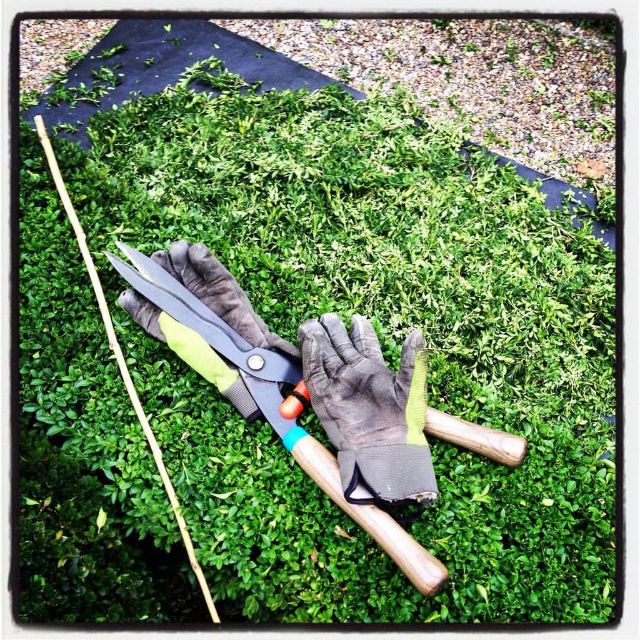
You are a gardener who needs to pick up both the gray fabric glove at center and the metallic shears at center. You can only reach one item at a time. If you first pick up the item that is closer to your hand, which one would you pick up first?

The gray fabric glove at center and metallic shears at center are 13.50 centimeters apart from each other, so you cannot determine which is closer to your hand without additional information about their positions relative to your starting point.

You are a gardener who needs to determine the placement of tools. If you have a storage box that can only accommodate items shorter than the metallic shears at center, will the gray fabric glove at center fit inside?

The gray fabric glove at center is shorter than the metallic shears at center, so it will fit inside the storage box designed for items shorter than the metallic shears at center.

You are a photographer aiming to capture a closeup of the garden shears and gloves. You notice two points in the scene marked as point 1 and point 2. If point 1 is at coordinates point [355,410] and point 2 is at point [252,396], which point should you focus on to ensure the garden shears and gloves are in sharp focus?

Point 1 at coordinates point [355,410] is closer to the camera than point 2 at point [252,396]. Therefore, focusing on point 1 will keep the garden shears and gloves in sharp focus since it is nearer to the camera.